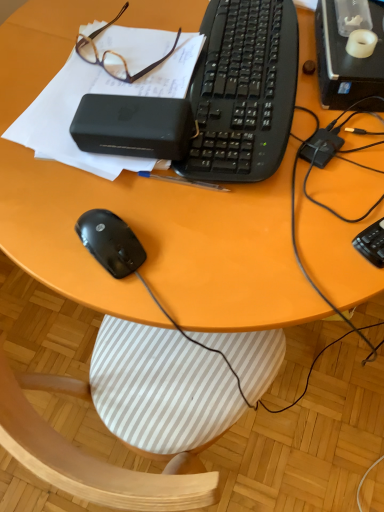
What are the coordinates of `vacant region to the left of brown plastic glasses at upper left` in the screenshot? It's located at (47, 54).